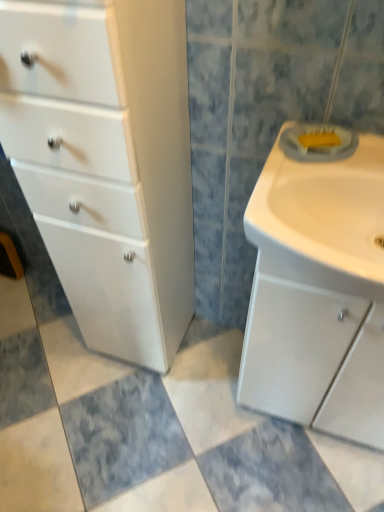
Find the location of `free spot to the left of white glossy cabinet at left`. free spot to the left of white glossy cabinet at left is located at coordinates (57, 356).